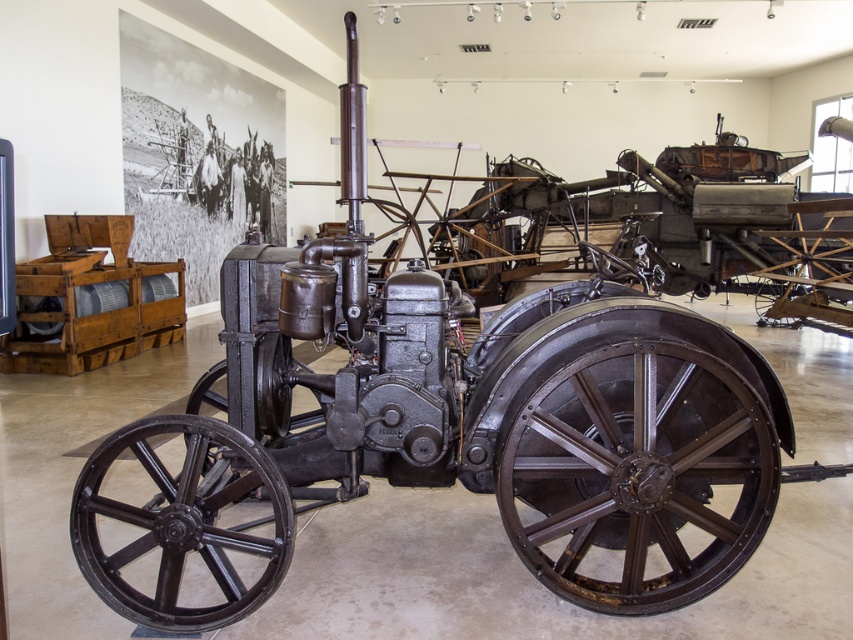
Consider the image. You are a museum guide explaining the vintage machinery. You point to the black cast iron wheel at center and the dark brown metal wheel at center. Which wheel do you tell visitors is larger?

The black cast iron wheel at center is bigger than the dark brown metal wheel at center.

You are a museum visitor carrying a 3.5 feet wide box and want to walk between the rusty metal wheel at center and the black cast iron wheel at center. Can you pass through without touching either wheel?

The distance between the rusty metal wheel at center and the black cast iron wheel at center is 4.31 feet. Since your box is 3.5 feet wide, there is enough space to pass through without touching either wheel.

You are a visitor in the museum and want to take a photo of the tractor. You notice two points marked on the floor at coordinates point (x=724, y=557) and point (x=230, y=556). Which point should you stand at to have the tractor in the foreground of your photo?

You should stand at point (x=724, y=557) because it is in front of point (x=230, y=556), allowing the tractor to be closer and in the foreground of your photo.